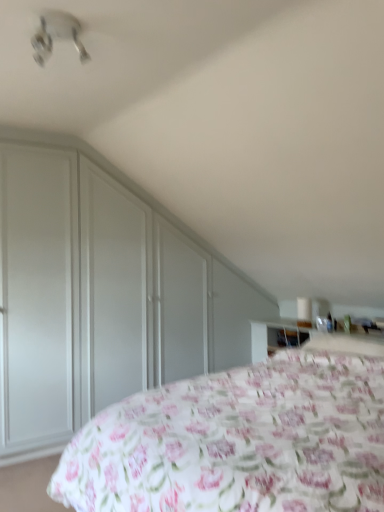
Question: Considering the relative sizes of matte white dresser at left and floral fabric bed at lower right in the image provided, is matte white dresser at left bigger than floral fabric bed at lower right?

Choices:
 (A) no
 (B) yes

Answer: (A)

Question: Considering the relative sizes of matte white dresser at left and floral fabric bed at lower right in the image provided, is matte white dresser at left thinner than floral fabric bed at lower right?

Choices:
 (A) yes
 (B) no

Answer: (A)

Question: From the image's perspective, does matte white dresser at left appear lower than floral fabric bed at lower right?

Choices:
 (A) no
 (B) yes

Answer: (A)

Question: Is matte white dresser at left behind floral fabric bed at lower right?

Choices:
 (A) no
 (B) yes

Answer: (B)

Question: From a real-world perspective, is matte white dresser at left positioned over floral fabric bed at lower right based on gravity?

Choices:
 (A) no
 (B) yes

Answer: (B)

Question: From a real-world perspective, is white plastic fan at upper left positioned above or below matte white dresser at left?

Choices:
 (A) below
 (B) above

Answer: (B)

Question: Considering the positions of white plastic fan at upper left and matte white dresser at left in the image, is white plastic fan at upper left wider or thinner than matte white dresser at left?

Choices:
 (A) wide
 (B) thin

Answer: (A)

Question: From their relative heights in the image, would you say white plastic fan at upper left is taller or shorter than matte white dresser at left?

Choices:
 (A) tall
 (B) short

Answer: (B)

Question: Relative to matte white dresser at left, is white plastic fan at upper left in front or behind?

Choices:
 (A) front
 (B) behind

Answer: (A)

Question: From their relative heights in the image, would you say floral fabric bed at lower right is taller or shorter than white plastic fan at upper left?

Choices:
 (A) short
 (B) tall

Answer: (B)

Question: From the image's perspective, is floral fabric bed at lower right positioned above or below white plastic fan at upper left?

Choices:
 (A) above
 (B) below

Answer: (B)

Question: Considering their positions, is floral fabric bed at lower right located in front of or behind white plastic fan at upper left?

Choices:
 (A) behind
 (B) front

Answer: (B)

Question: Would you say floral fabric bed at lower right is to the left or to the right of white plastic fan at upper left in the picture?

Choices:
 (A) right
 (B) left

Answer: (A)

Question: Would you say matte white dresser at left is to the left or to the right of floral fabric bed at lower right in the picture?

Choices:
 (A) left
 (B) right

Answer: (A)

Question: From the image's perspective, relative to floral fabric bed at lower right, is matte white dresser at left above or below?

Choices:
 (A) below
 (B) above

Answer: (B)